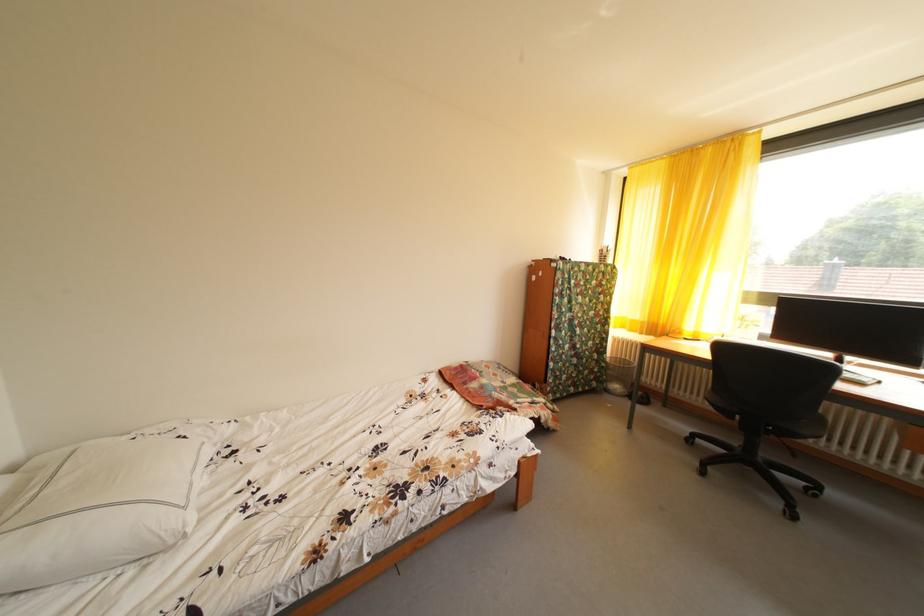
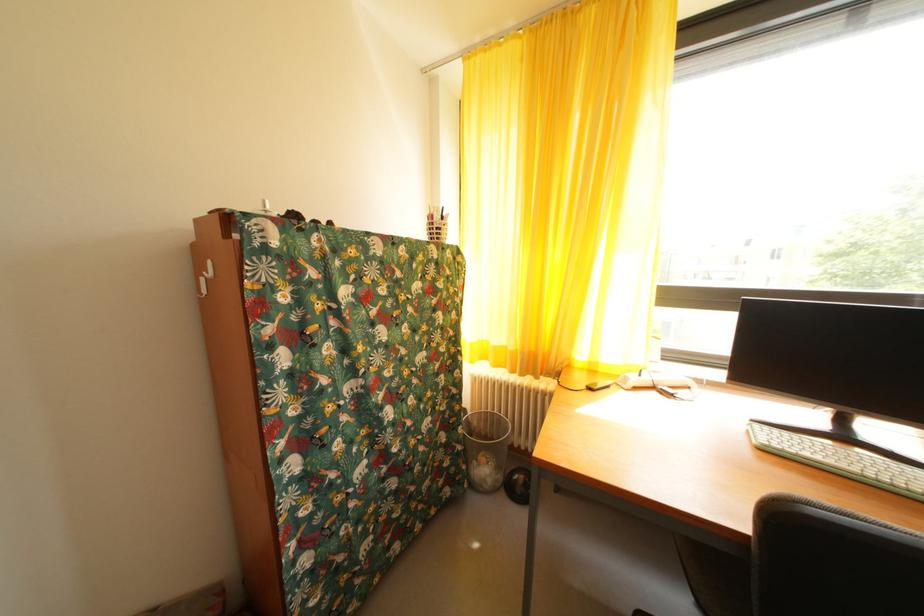
Where in the second image is the point corresponding to (611,257) from the first image?

(440, 223)